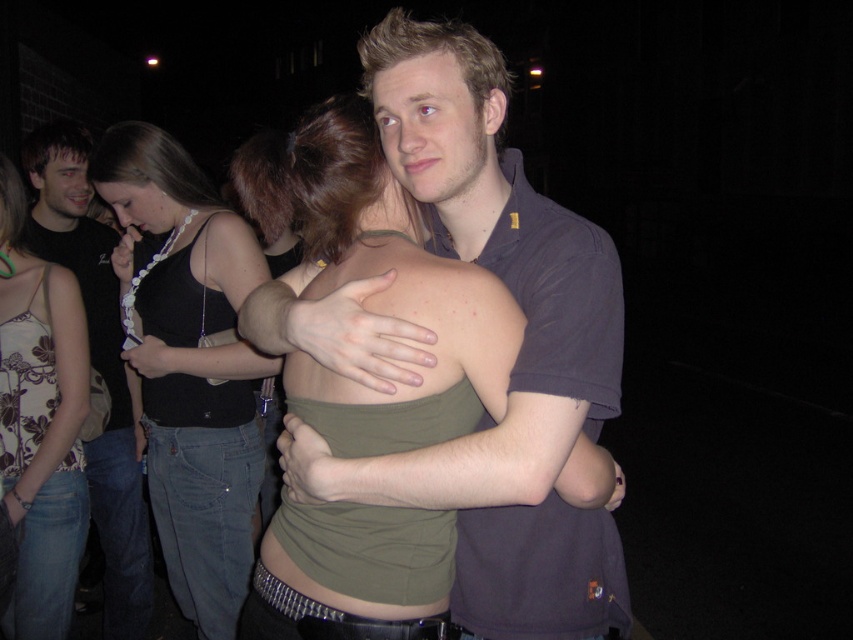
You are a photographer trying to capture a closeup of the black fabric top at upper left and the matte black tank top at left. Since you can only focus on one at a time, which one should you focus on first if you want to ensure both are in the frame without moving the camera?

The matte black tank top at left should be focused on first because the black fabric top at upper left is to the right of it, meaning they are positioned side by side. By focusing on the leftmost object first, you can adjust the camera to include both in the frame without moving it.